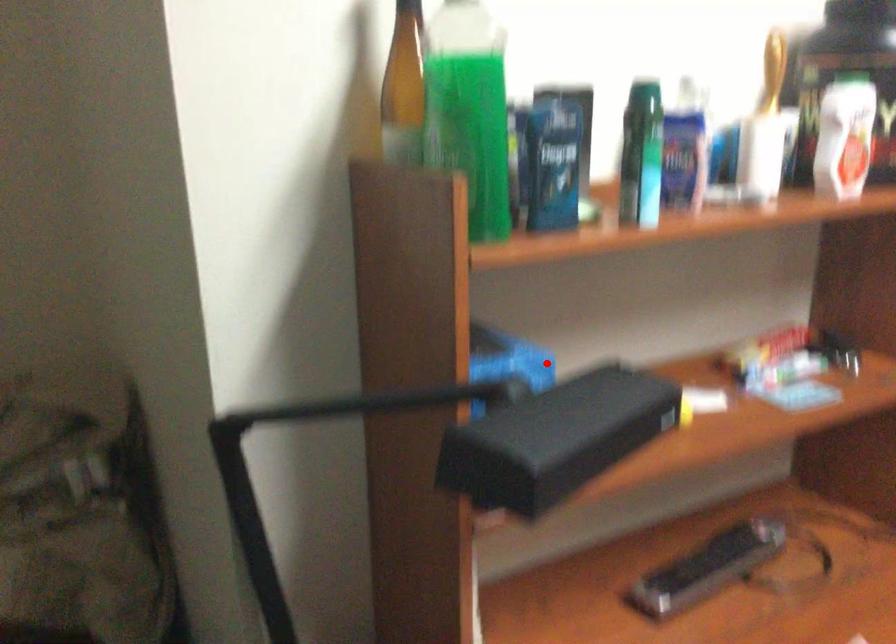
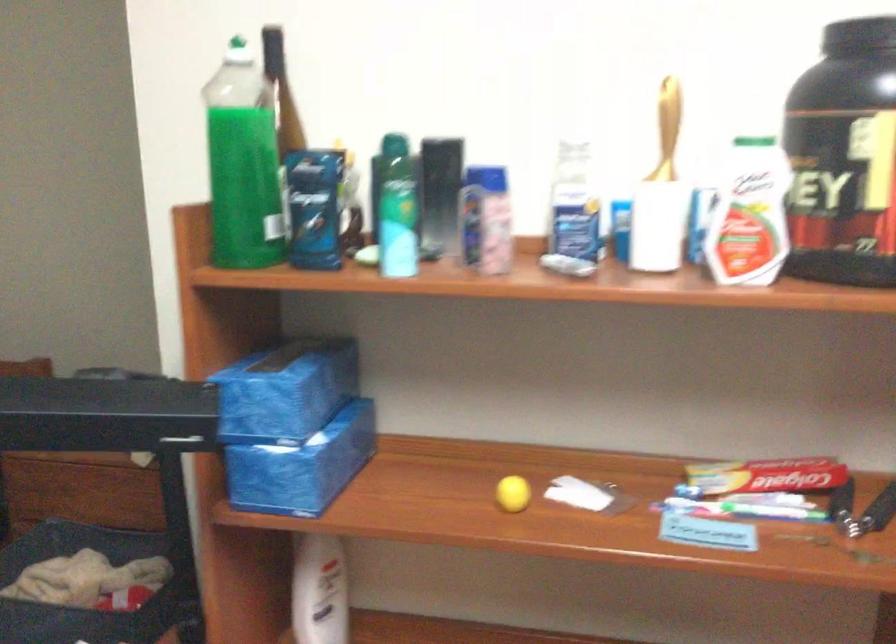
Question: I am providing you with two images of the same scene from different viewpoints. A red point is shown in image1. For the corresponding object point in image2, is it positioned nearer or farther from the camera?

Choices:
 (A) Nearer
 (B) Farther

Answer: (B)